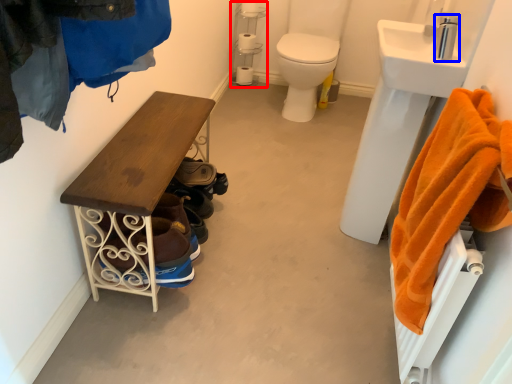
Question: Which point is further to the camera, shelf (highlighted by a red box) or faucet (highlighted by a blue box)?

Choices:
 (A) shelf
 (B) faucet

Answer: (A)